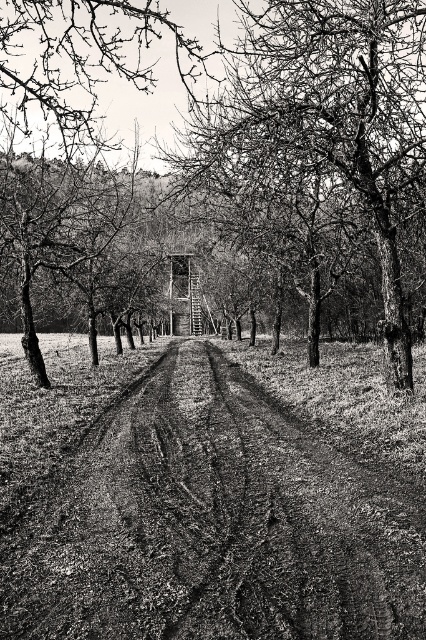
Question: Does dirt track at center appear on the right side of smooth bark tree at center?

Choices:
 (A) yes
 (B) no

Answer: (B)

Question: Among these objects, which one is nearest to the camera?

Choices:
 (A) smooth bark tree at center
 (B) dirt track at center

Answer: (B)

Question: Is dirt track at center below smooth bark tree at center?

Choices:
 (A) yes
 (B) no

Answer: (A)

Question: Is dirt track at center above smooth bark tree at center?

Choices:
 (A) yes
 (B) no

Answer: (B)